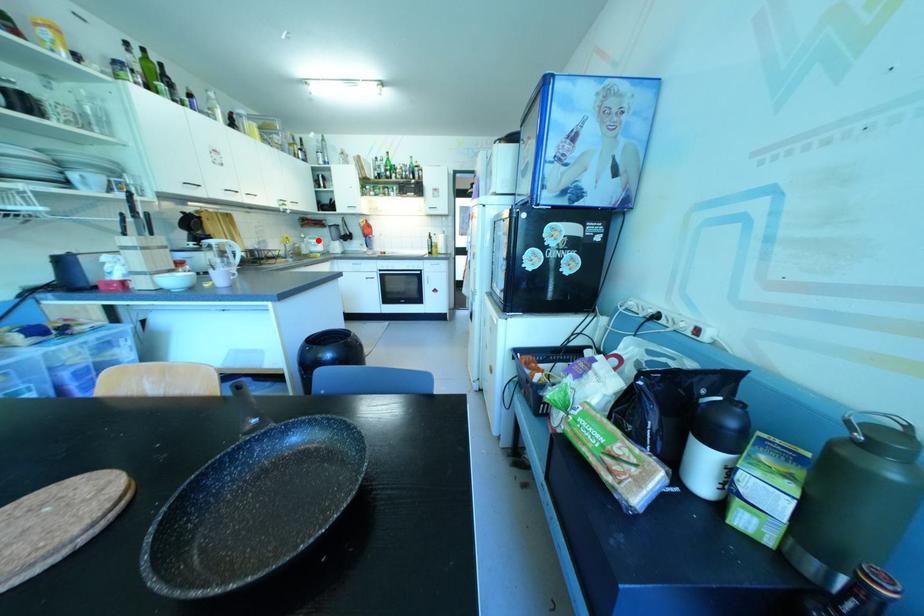
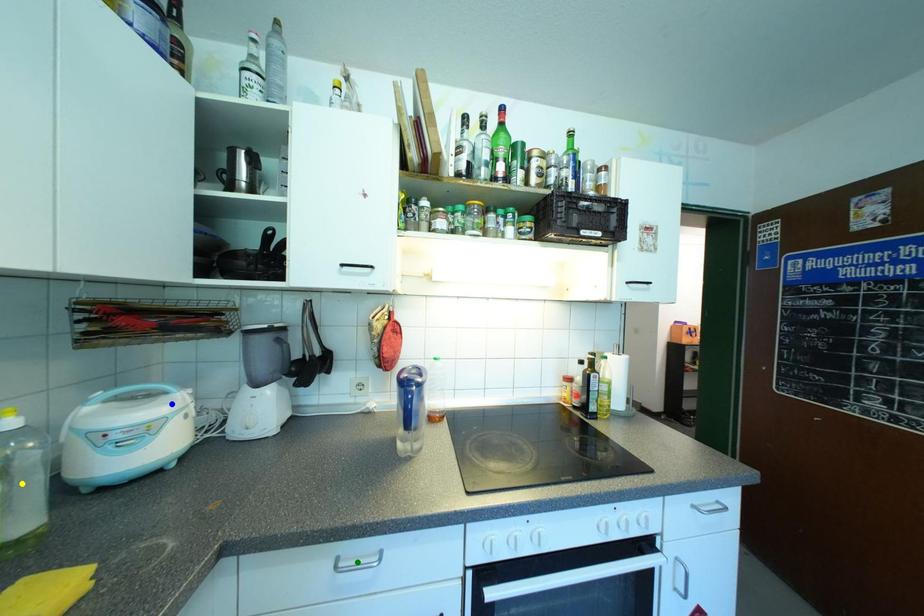
Question: I am providing you with two images of the same scene from different viewpoints. A red point is marked on the first image. You are given multiple points on the second image. In image 2, which mark is for the same physical point as the one in image 1?

Choices:
 (A) blue point
 (B) yellow point
 (C) green point

Answer: (A)